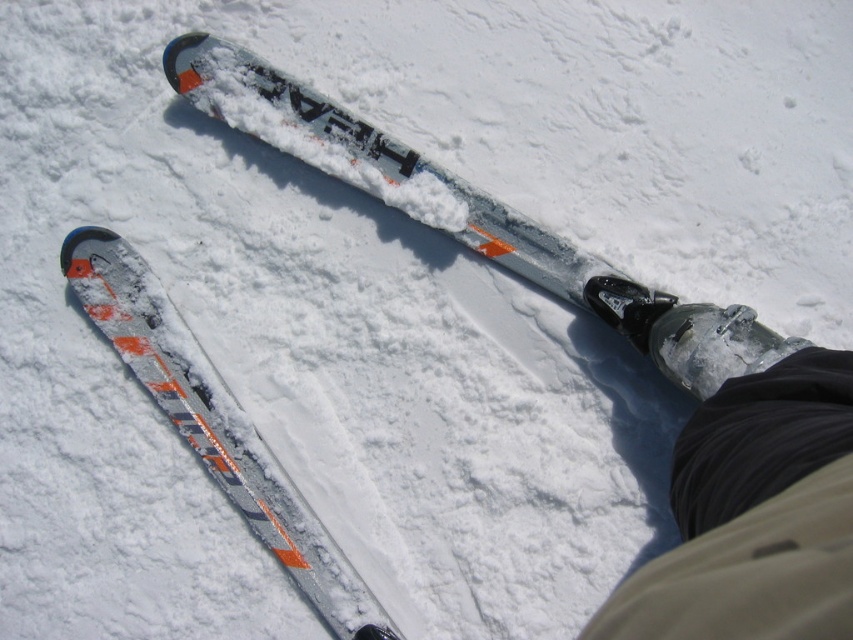
Question: Where is black matte boot at lower right located in relation to silver metallic ski at center in the image?

Choices:
 (A) below
 (B) above

Answer: (B)

Question: Which object is farther from the camera taking this photo?

Choices:
 (A) black matte boot at lower right
 (B) silver metallic ski at center

Answer: (B)

Question: Does black matte boot at lower right have a lesser width compared to silver metallic ski at center?

Choices:
 (A) yes
 (B) no

Answer: (A)

Question: Is black matte boot at lower right bigger than silver metallic ski at center?

Choices:
 (A) no
 (B) yes

Answer: (B)